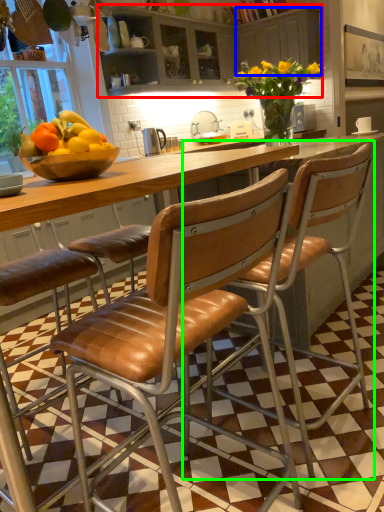
Question: Which is nearer to the cabinetry (highlighted by a red box)? cabinetry (highlighted by a blue box) or chair (highlighted by a green box).

Choices:
 (A) cabinetry
 (B) chair

Answer: (A)